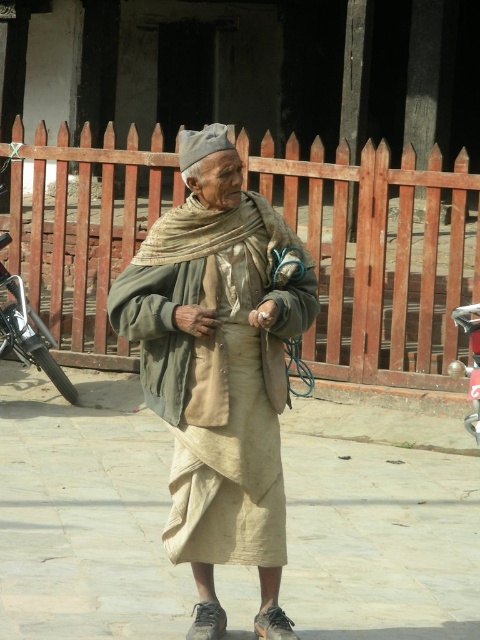
At what (x,y) coordinates should I click in order to perform the action: click on beige fabric skirt at center. Please return your answer as a coordinate pair (x, y). This screenshot has width=480, height=640. Looking at the image, I should click on click(84, 513).

Between beige fabric skirt at center and beige fabric shawl at center, which one appears on the left side from the viewer's perspective?

From the viewer's perspective, beige fabric skirt at center appears more on the left side.

Where is `beige fabric skirt at center`? This screenshot has height=640, width=480. beige fabric skirt at center is located at coordinates (84, 513).

Where is `beige fabric skirt at center`? The height and width of the screenshot is (640, 480). beige fabric skirt at center is located at coordinates (84, 513).